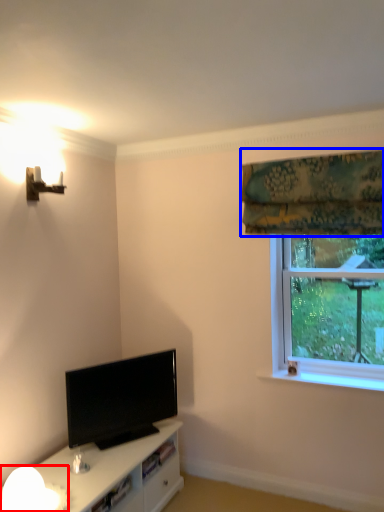
Question: Which point is closer to the camera, lamp (highlighted by a red box) or curtain (highlighted by a blue box)?

Choices:
 (A) lamp
 (B) curtain

Answer: (A)